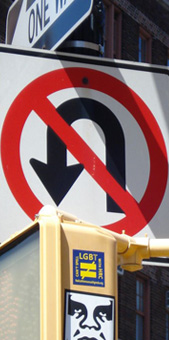
At what (x,y) coordinates should I click in order to perform the action: click on window. Please return your answer as a coordinate pair (x, y). Looking at the image, I should click on (140, 307).